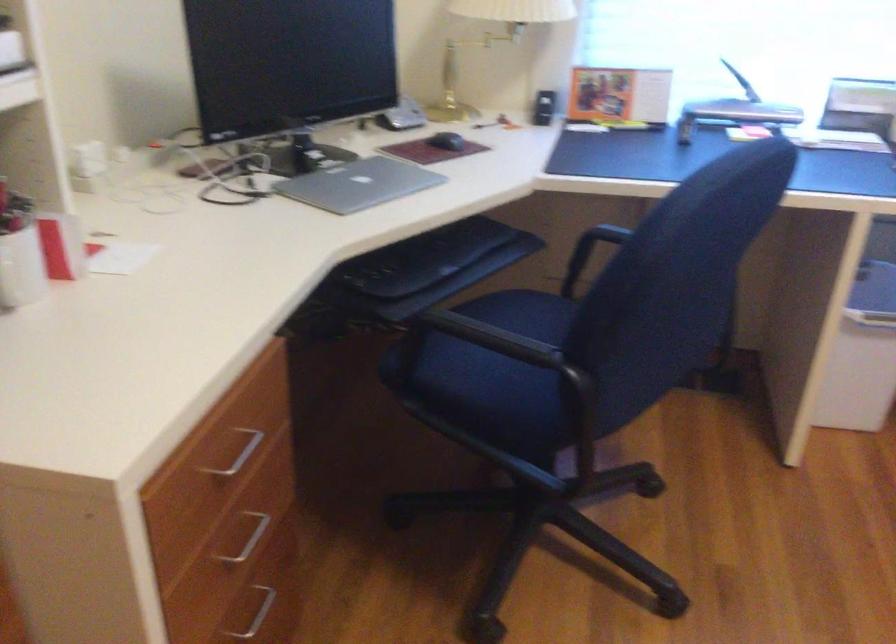
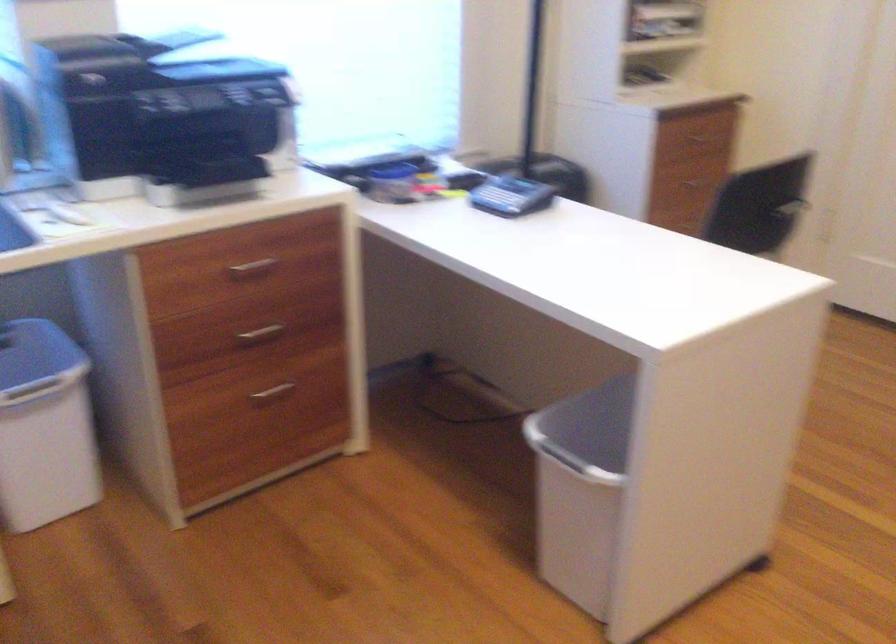
Question: Based on the continuous images, in which direction is the camera rotating? Reply with the corresponding letter.

Choices:
 (A) Left
 (B) Right
 (C) Up
 (D) Down

Answer: (B)